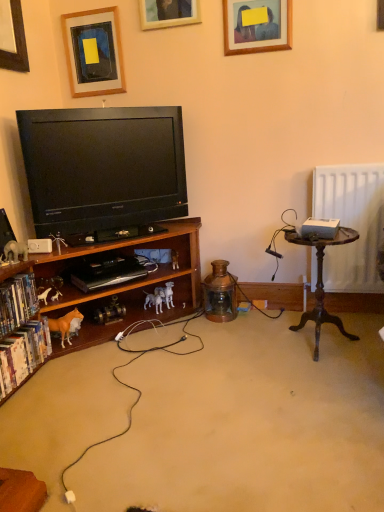
Question: From the image's perspective, is hardcover books at lower left, which is counted as the 2th book, starting from the bottom, above or below brown plastic horse at lower left, the second toy from the front?

Choices:
 (A) below
 (B) above

Answer: (A)

Question: Relative to brown plastic horse at lower left, the second toy from the front, is hardcover books at lower left, the 1th book viewed from the top, in front or behind?

Choices:
 (A) front
 (B) behind

Answer: (A)

Question: Which of these objects is positioned farthest from the wooden picture frame at upper left, which is the 1th picture frame in left-to-right order?

Choices:
 (A) matte white elephant at lower left, which is the 4th toy from right to left
 (B) brown matte horse at lower left
 (C) wooden vintage table at right
 (D) black glossy television at left
 (E) white plastic speaker at lower left

Answer: (C)

Question: Based on their relative distances, which object is nearer to the wooden picture frame at upper center, which ranks as the 1th picture frame in right-to-left order?

Choices:
 (A) white plastic dog at lower center, placed as the 4th toy when sorted from front to back
 (B) matte white elephant at lower left, arranged as the first toy when viewed from the left
 (C) wooden picture frame at upper center, positioned as the second picture frame in right-to-left order
 (D) white plastic speaker at lower left
 (E) wooden vintage table at right

Answer: (C)